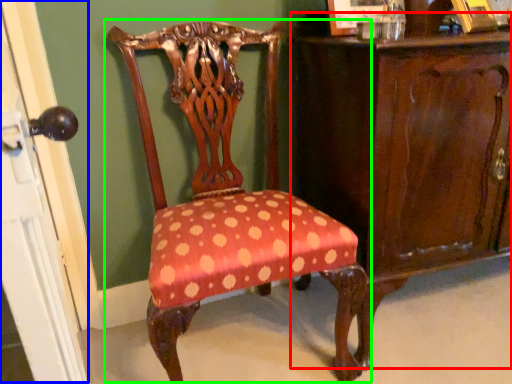
Question: Estimate the real-world distances between objects in this image. Which object is farther from vanity (highlighted by a red box), screen door (highlighted by a blue box) or chair (highlighted by a green box)?

Choices:
 (A) screen door
 (B) chair

Answer: (A)